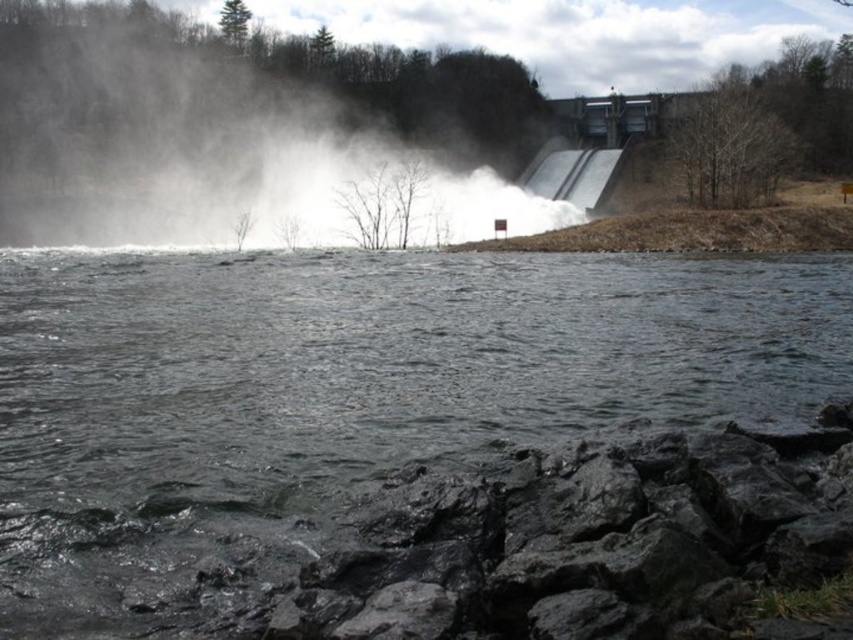
You are standing at the dam and want to locate two points marked in the image. The first point is at coordinates point (392,100) and the second is at point (584,186). Which point is closer to you?

Point (392,100) is closer to you because it is further to the viewer than point (584,186).

You are a photographer planning to capture the mist and dam in the image. Given that the white mist at upper center and the gray metallic dam at upper right are both in the frame, which one would appear more prominent in your photo based on their sizes?

The white mist at upper center would appear more prominent in the photo because it has a larger size compared to the gray metallic dam at upper right.

You are standing on the rocky shoreline and see the dark gray rock at lower center and the white mist at upper center. Which object is closer to you?

The dark gray rock at lower center is closer to you because it is positioned under the white mist at upper center, indicating it is lower in the scene.